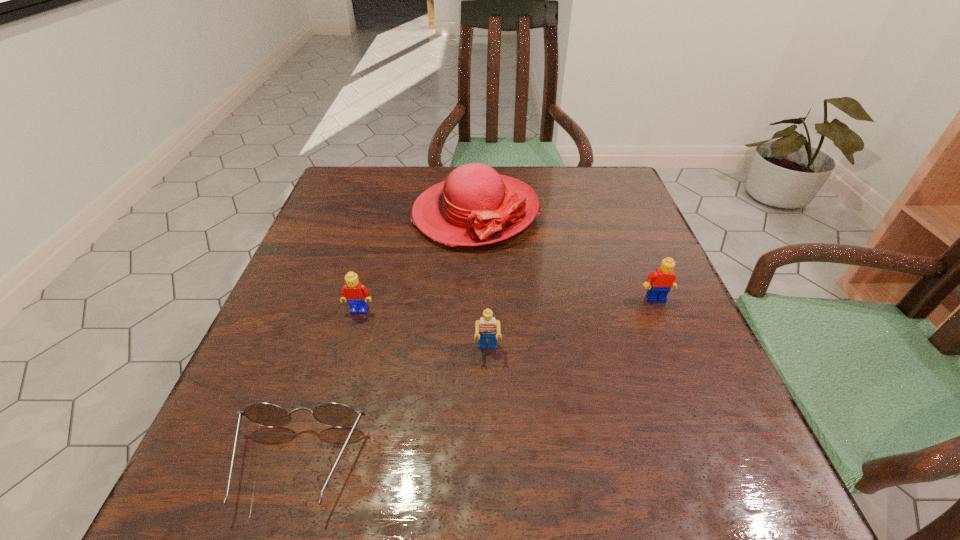
The image size is (960, 540). I want to click on the tallest object, so click(x=474, y=206).

Identify the location of hat. (x=474, y=206).

Identify the location of the second farthest object. This screenshot has height=540, width=960. (663, 279).

I want to click on the farthest Lego, so click(663, 279).

Identify the location of the leftmost Lego. The width and height of the screenshot is (960, 540). (356, 294).

The height and width of the screenshot is (540, 960). I want to click on the second farthest Lego, so click(x=356, y=294).

You are a GUI agent. You are given a task and a screenshot of the screen. Output one action in this format:
    pyautogui.click(x=<x>, y=<y>)
    Task: Click on the second Lego from left to right
    The image size is (960, 540).
    Given the screenshot: What is the action you would take?
    pyautogui.click(x=487, y=327)

Identify the location of the nearest Lego. (487, 327).

At what (x,y) coordinates should I click in order to perform the action: click on the nearest object. Please return your answer as a coordinate pair (x, y). Looking at the image, I should click on tap(333, 414).

Where is `spectacles`? spectacles is located at coordinates (333, 414).